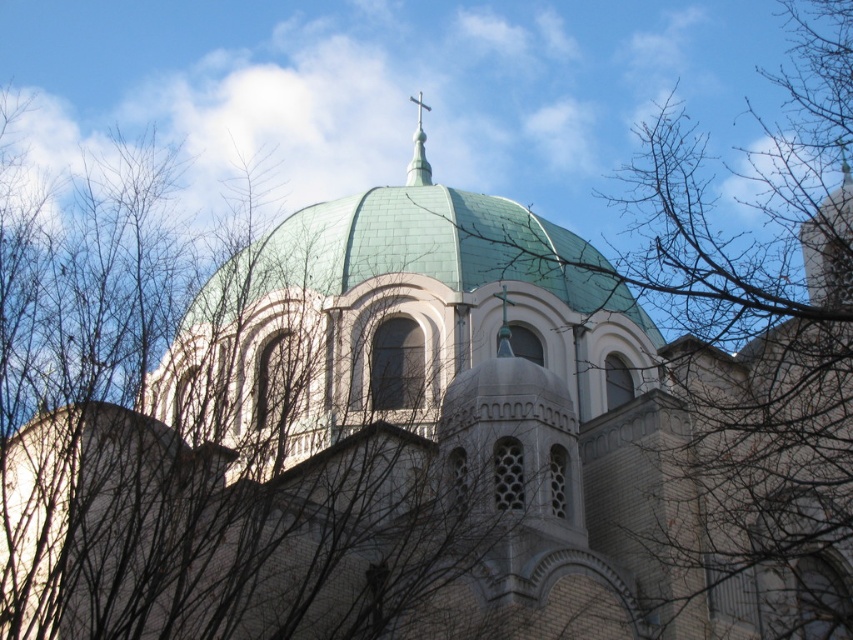
Question: In this image, where is green tile dome at center located relative to green metallic spire at upper center?

Choices:
 (A) above
 (B) below

Answer: (B)

Question: Which object appears closest to the camera in this image?

Choices:
 (A) green tile dome at center
 (B) green metallic spire at upper center

Answer: (A)

Question: Which object is positioned closest to the green metallic spire at upper center?

Choices:
 (A) bare branches at upper center
 (B) green tile dome at center

Answer: (B)

Question: Is bare branches at upper center thinner than green metallic spire at upper center?

Choices:
 (A) no
 (B) yes

Answer: (A)

Question: Among these objects, which one is farthest from the camera?

Choices:
 (A) bare branches at upper center
 (B) green metallic spire at upper center

Answer: (B)

Question: Can you confirm if green tile dome at center is wider than green metallic spire at upper center?

Choices:
 (A) yes
 (B) no

Answer: (A)